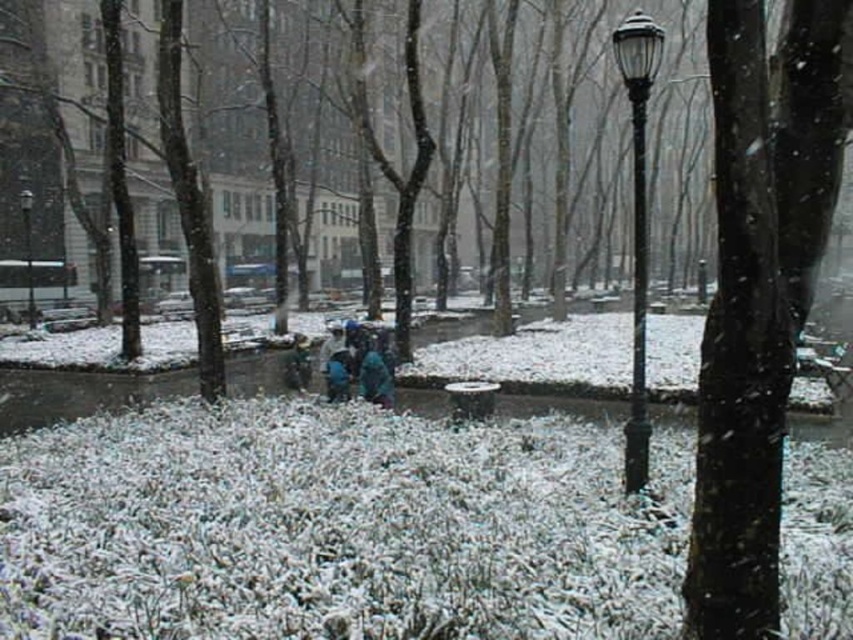
Question: Based on their relative distances, which object is nearer to the black smooth tree trunk at center?

Choices:
 (A) black polished metal lamp post at right
 (B) black glass lamp post at center

Answer: (A)

Question: Can you confirm if black polished metal lamp post at right is wider than black glass lamp post at center?

Choices:
 (A) no
 (B) yes

Answer: (B)

Question: In this image, where is black smooth tree trunk at center located relative to black polished metal lamp post at right?

Choices:
 (A) below
 (B) above

Answer: (A)

Question: Is black smooth tree trunk at center smaller than black polished metal lamp post at right?

Choices:
 (A) no
 (B) yes

Answer: (B)

Question: Which point is closer to the camera taking this photo?

Choices:
 (A) (633, 45)
 (B) (798, 227)
 (C) (26, 317)

Answer: (B)

Question: Estimate the real-world distances between objects in this image. Which object is farther from the black polished metal lamp post at right?

Choices:
 (A) black smooth tree trunk at center
 (B) black glass lamp post at center

Answer: (B)